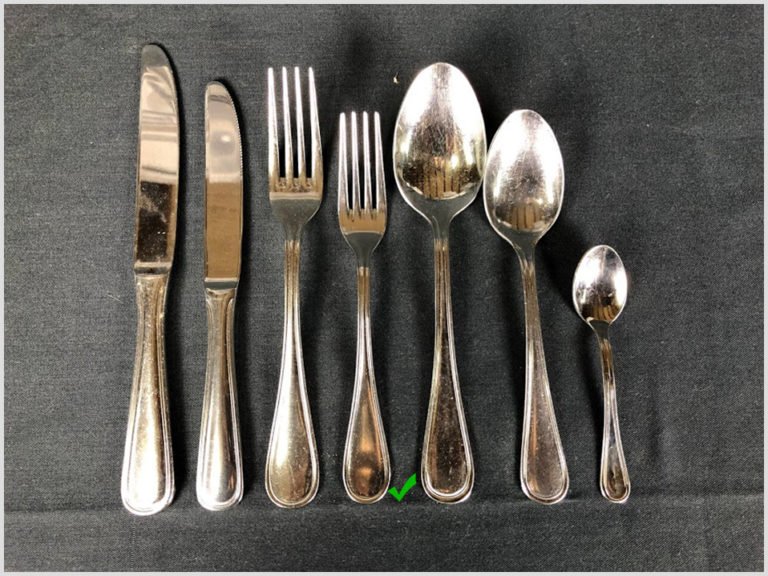
Where is `utensil handles`? utensil handles is located at coordinates (137, 466), (223, 453), (296, 458), (363, 452), (448, 469), (545, 466), (616, 472).